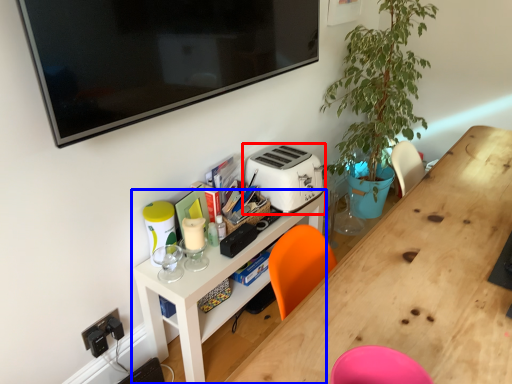
Question: Which point is further to the camera, toaster (highlighted by a red box) or shelf (highlighted by a blue box)?

Choices:
 (A) toaster
 (B) shelf

Answer: (A)